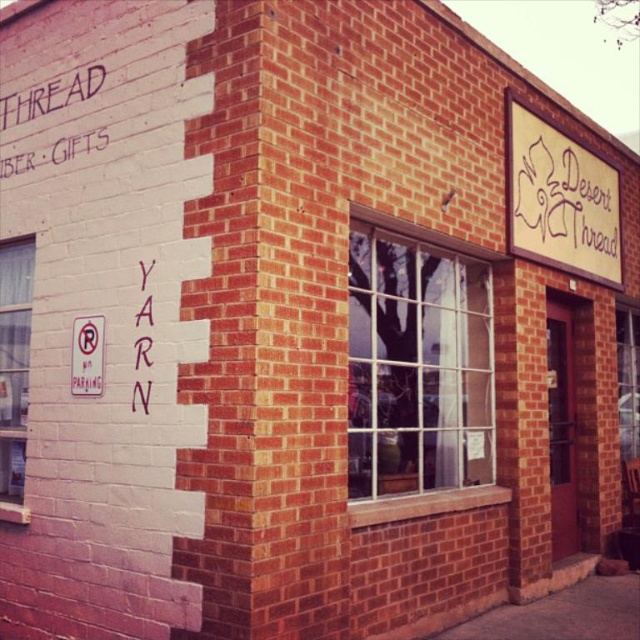
Question: Is clear glass window at left further to the viewer compared to white chalk writing at upper left?

Choices:
 (A) yes
 (B) no

Answer: (A)

Question: Among these points, which one is nearest to the camera?

Choices:
 (A) (8, 454)
 (B) (396, 480)
 (C) (145, 388)
 (D) (96, 67)

Answer: (C)

Question: Estimate the real-world distances between objects in this image. Which object is closer to the red plastic no parking sign at left?

Choices:
 (A) clear glass window at left
 (B) white chalk writing at upper left
 (C) white matte yarn at upper left
 (D) clear glass window at center

Answer: (C)

Question: Is clear glass window at center further to the viewer compared to white matte yarn at upper left?

Choices:
 (A) no
 (B) yes

Answer: (B)

Question: Which point is closer to the camera taking this photo?

Choices:
 (A) (72, 100)
 (B) (88, 378)
 (C) (413, 404)

Answer: (B)

Question: Observing the image, what is the correct spatial positioning of clear glass window at center in reference to beige textured sign at upper right?

Choices:
 (A) above
 (B) below

Answer: (B)